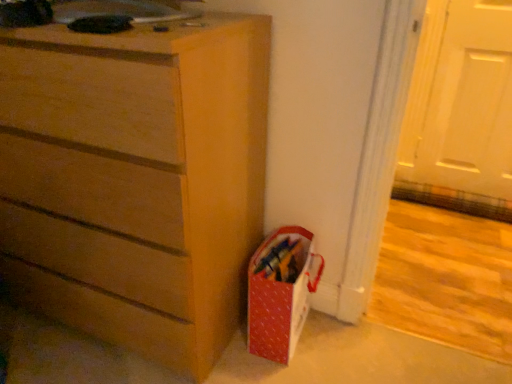
The height and width of the screenshot is (384, 512). I want to click on free point in front of matte red gift bag at lower right, so click(x=280, y=369).